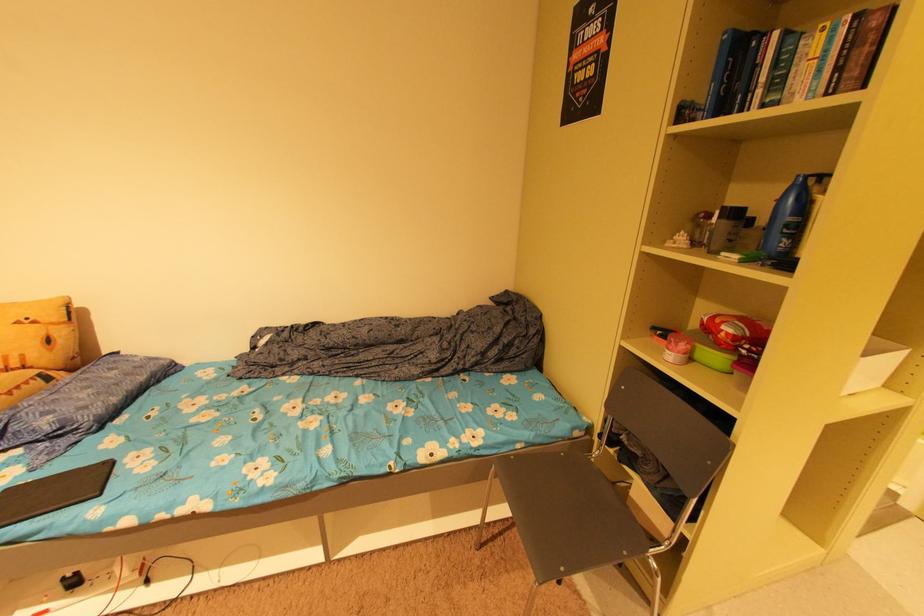
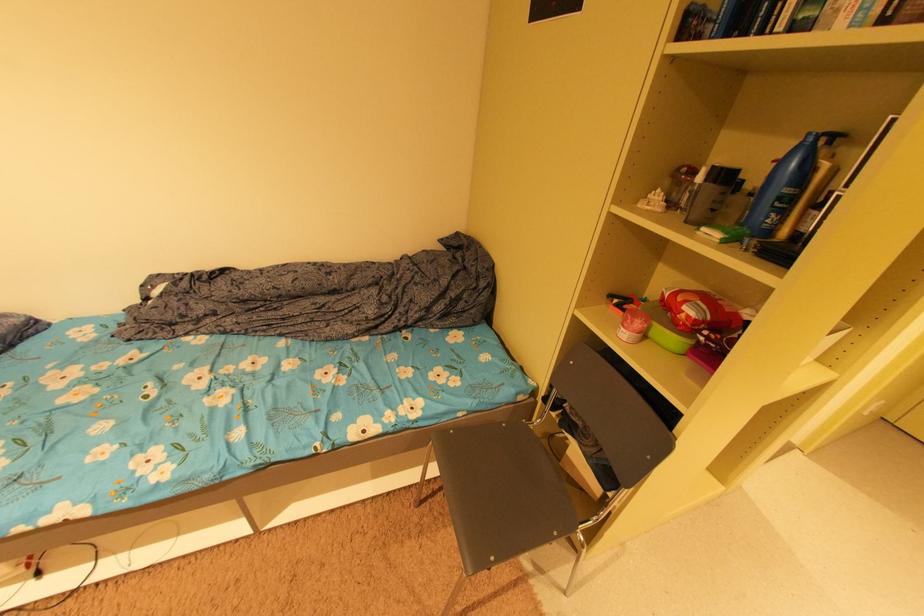
Question: The first image is from the beginning of the video and the second image is from the end. How did the camera likely rotate when shooting the video?

Choices:
 (A) Left
 (B) Right
 (C) Up
 (D) Down

Answer: (D)